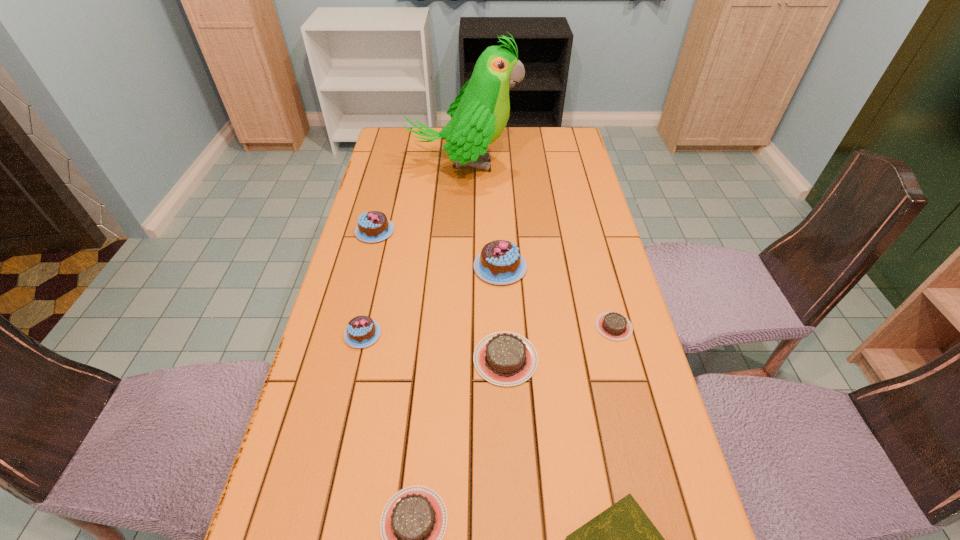
The image size is (960, 540). In order to click on object located in the right edge section of the desktop in this screenshot , I will do `click(612, 325)`.

Locate an element on the screen. The height and width of the screenshot is (540, 960). object located in the far left corner section of the desktop is located at coordinates click(479, 114).

Locate an element on the screen. This screenshot has height=540, width=960. vacant point at the far edge is located at coordinates (510, 136).

This screenshot has width=960, height=540. Identify the location of free location at the left edge. (334, 382).

The width and height of the screenshot is (960, 540). In the image, there is a desktop. In order to click on free space at the right edge in this screenshot , I will do `click(563, 192)`.

The image size is (960, 540). What are the coordinates of `vacant space at the far left corner of the desktop` in the screenshot? It's located at (419, 145).

In the image, there is a desktop. At what (x,y) coordinates should I click in order to perform the action: click on free space at the far right corner. Please return your answer as a coordinate pair (x, y). The image size is (960, 540). Looking at the image, I should click on (539, 143).

You are a GUI agent. You are given a task and a screenshot of the screen. Output one action in this format:
    pyautogui.click(x=<x>, y=<y>)
    Task: Click on the unoccupied area between the fourth tallest chocolate cake and the smallest pink chocolate cake
    This screenshot has height=540, width=960.
    Given the screenshot: What is the action you would take?
    pyautogui.click(x=434, y=347)

Find the location of `empty space between the farthest chocolate cake and the tallest object`. empty space between the farthest chocolate cake and the tallest object is located at coordinates (419, 198).

Locate which object is the closest to the rightmost brown chocolate cake. Please provide its 2D coordinates. Your answer should be formatted as a tuple, i.e. [(x, y)], where the tuple contains the x and y coordinates of a point satisfying the conditions above.

[(504, 358)]